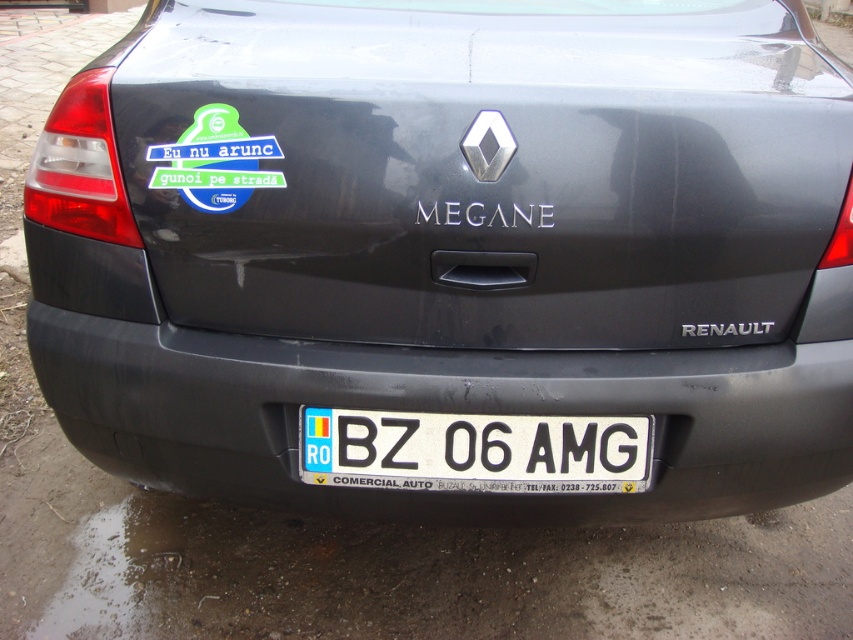
Question: Which object is farther from the camera taking this photo?

Choices:
 (A) black matte bumper at lower center
 (B) white plastic license plate at center

Answer: (B)

Question: Is black matte bumper at lower center smaller than white plastic license plate at center?

Choices:
 (A) no
 (B) yes

Answer: (A)

Question: Is brown dirt at lower center in front of white plastic license plate at center?

Choices:
 (A) yes
 (B) no

Answer: (B)

Question: Can you confirm if brown dirt at lower center is positioned to the left of white plastic license plate at center?

Choices:
 (A) no
 (B) yes

Answer: (B)

Question: Among these points, which one is nearest to the camera?

Choices:
 (A) (732, 525)
 (B) (656, 461)
 (C) (404, 477)

Answer: (C)

Question: Which object appears closest to the camera in this image?

Choices:
 (A) brown dirt at lower center
 (B) black matte bumper at lower center

Answer: (B)